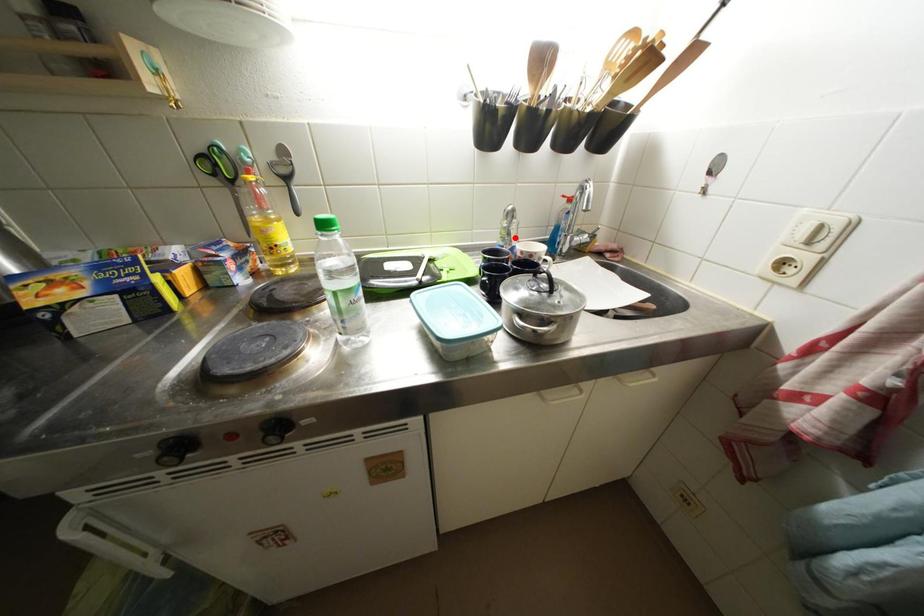
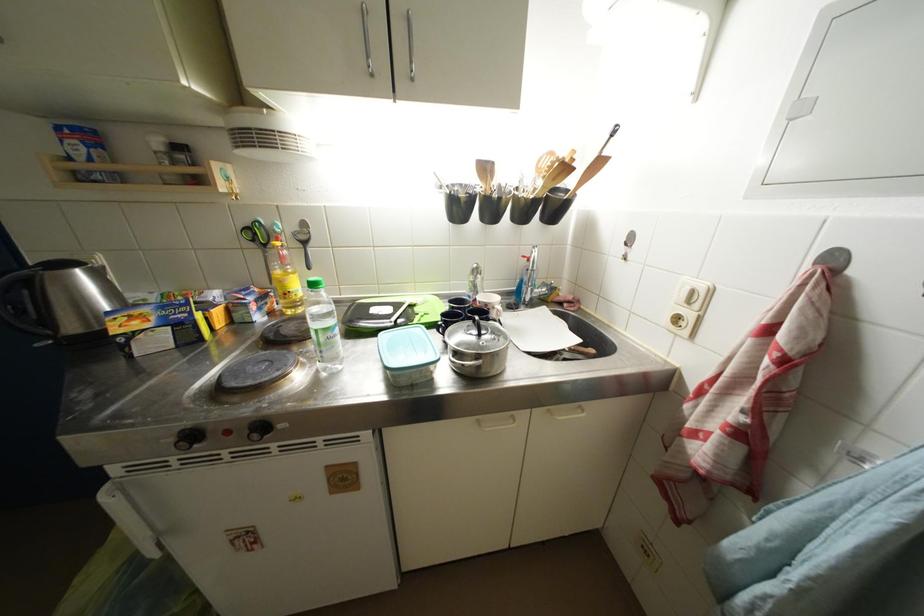
In the second image, find the point that corresponds to the highlighted location in the first image.

(481, 291)